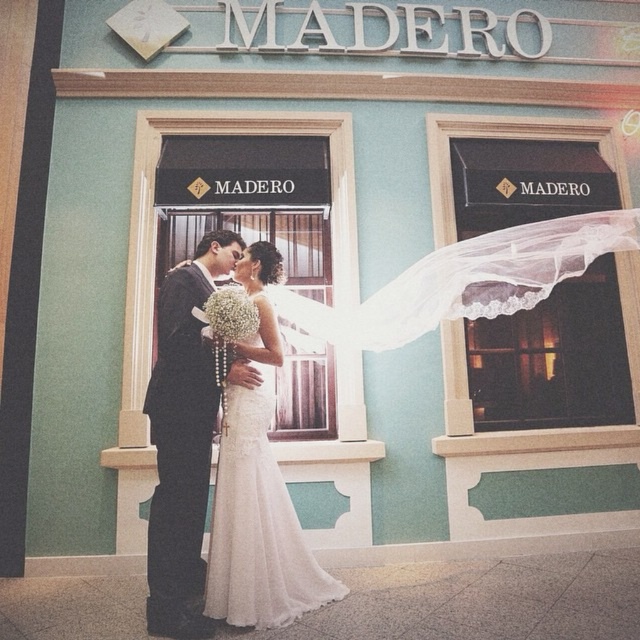
Question: Which point is farther from the camera taking this photo?

Choices:
 (A) (289, 515)
 (B) (198, 272)

Answer: (B)

Question: Can you confirm if matte black suit at center is positioned to the right of white lace wedding dress at center?

Choices:
 (A) no
 (B) yes

Answer: (A)

Question: Is matte black suit at center thinner than white lace wedding dress at center?

Choices:
 (A) yes
 (B) no

Answer: (A)

Question: Can you confirm if matte black suit at center is positioned to the right of white lace wedding dress at center?

Choices:
 (A) yes
 (B) no

Answer: (B)

Question: Which point is closer to the camera?

Choices:
 (A) (188, 378)
 (B) (262, 349)

Answer: (A)